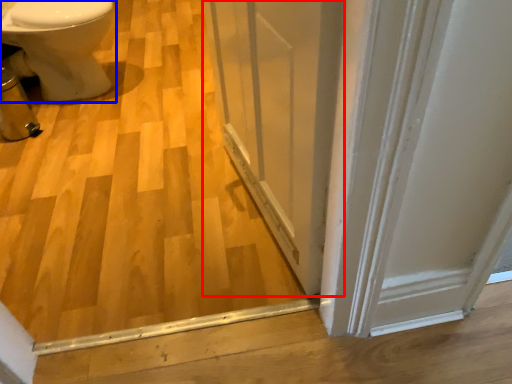
Question: Which of the following is the closest to the observer, screen door (highlighted by a red box) or bidet (highlighted by a blue box)?

Choices:
 (A) screen door
 (B) bidet

Answer: (A)